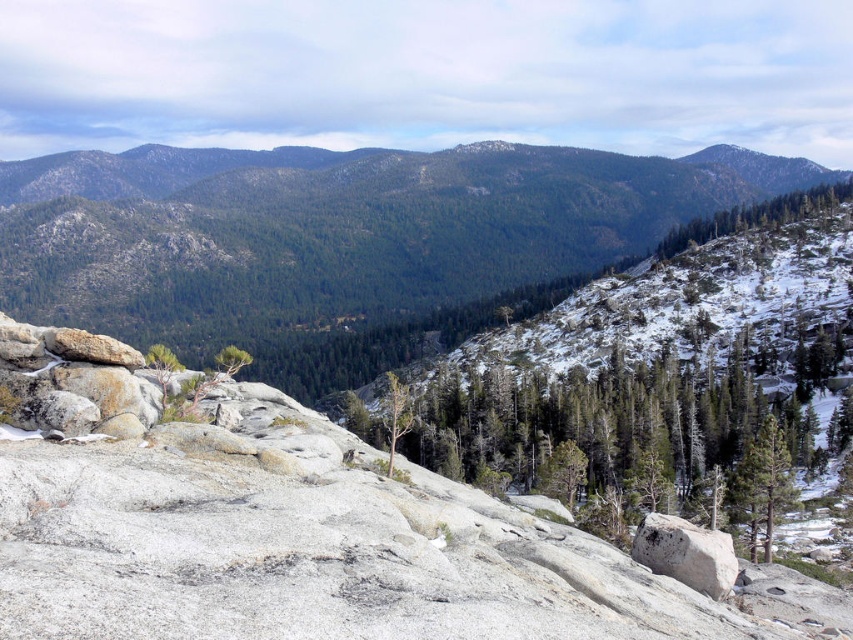
Question: Which point is closer to the camera?

Choices:
 (A) (672, 552)
 (B) (334, 294)

Answer: (A)

Question: Is rocky terrain at center wider than gray rough rock at center?

Choices:
 (A) yes
 (B) no

Answer: (A)

Question: Which object appears closest to the camera in this image?

Choices:
 (A) gray rough rock at center
 (B) rocky terrain at center

Answer: (A)

Question: Among these objects, which one is nearest to the camera?

Choices:
 (A) rocky terrain at center
 (B) gray rough rock at center

Answer: (B)

Question: Can you confirm if rocky terrain at center is smaller than gray rough rock at center?

Choices:
 (A) yes
 (B) no

Answer: (B)

Question: From the image, what is the correct spatial relationship of rocky terrain at center in relation to gray rough rock at center?

Choices:
 (A) below
 (B) above

Answer: (B)